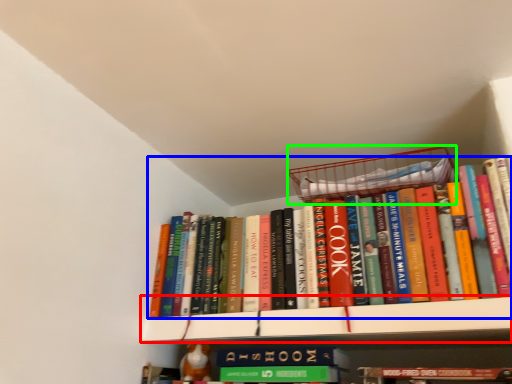
Question: Which object is positioned closest to shelf (highlighted by a red box)? Select from book (highlighted by a blue box) and basket (highlighted by a green box).

Choices:
 (A) book
 (B) basket

Answer: (A)